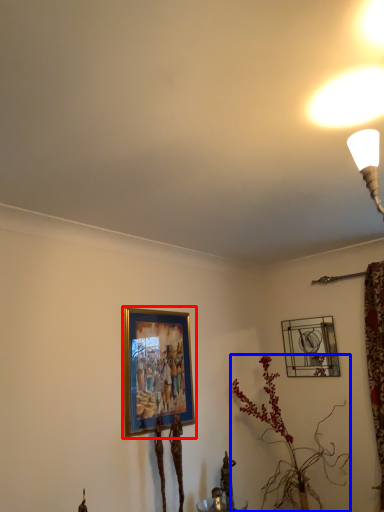
Question: Which object appears closest to the camera in this image, picture frame (highlighted by a red box) or houseplant (highlighted by a blue box)?

Choices:
 (A) picture frame
 (B) houseplant

Answer: (A)